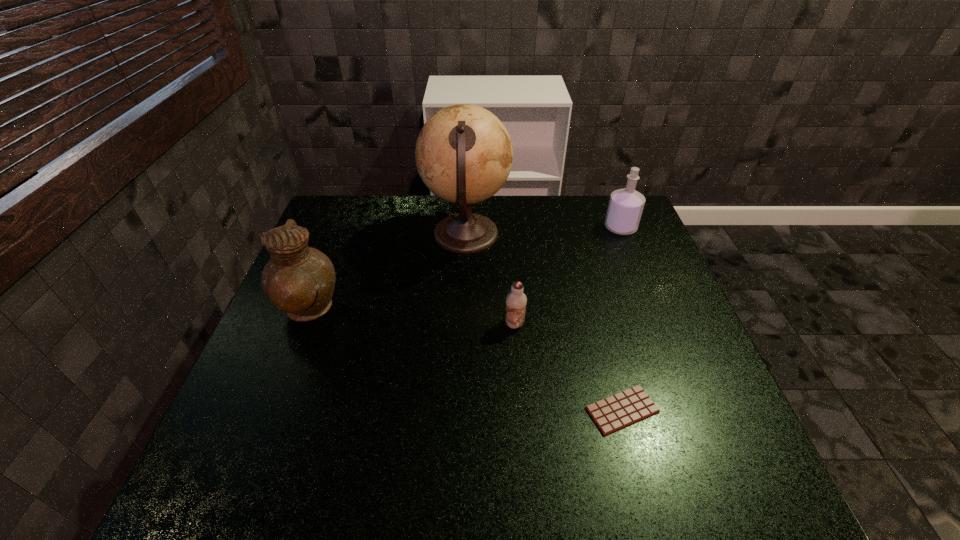
Where is `vacant area situated on the left of the rightmost object`? The image size is (960, 540). vacant area situated on the left of the rightmost object is located at coordinates (586, 228).

Where is `vacant region located on the right of the fourth tallest object`? vacant region located on the right of the fourth tallest object is located at coordinates (659, 324).

Locate an element on the screen. This screenshot has height=540, width=960. free region located 0.060m on the right of the candy bar is located at coordinates (688, 410).

You are a GUI agent. You are given a task and a screenshot of the screen. Output one action in this format:
    pyautogui.click(x=<x>, y=<y>)
    Task: Click on the globe that is positioned at the far edge
    This screenshot has height=540, width=960.
    Given the screenshot: What is the action you would take?
    pyautogui.click(x=464, y=155)

The image size is (960, 540). Identify the location of perfume situated at the far edge. (625, 208).

I want to click on object at the left edge, so click(299, 280).

This screenshot has height=540, width=960. In order to click on perfume present at the right edge in this screenshot , I will do `click(625, 208)`.

Locate an element on the screen. The height and width of the screenshot is (540, 960). candy bar present at the right edge is located at coordinates (613, 413).

In order to click on object situated at the far right corner in this screenshot , I will do `click(625, 208)`.

Where is `vacant space at the far edge of the desktop`? vacant space at the far edge of the desktop is located at coordinates (505, 214).